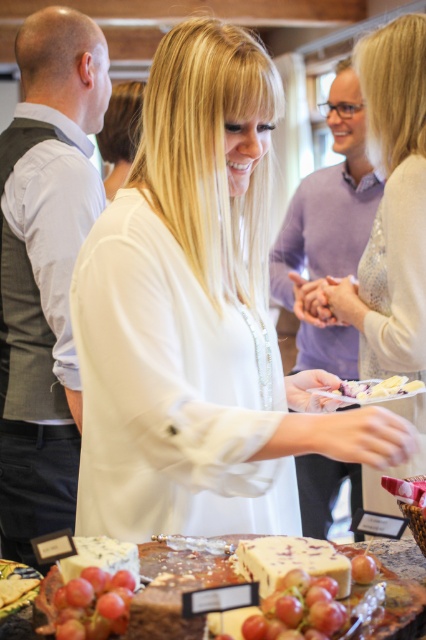
You are at a party and want to grab a smooth red apple at center. You are currently standing behind the smooth wooden table at center. Can you reach the apple without moving around the table?

The smooth wooden table at center is in front of the smooth red apple at center, so you are behind the table and the apple is in front of the table. Therefore, the apple is between you and the table, meaning you can reach it without needing to move around the table.

You are at a party and want to place a smooth red apple at center on the table. Is the smooth wooden table at center the correct place to put it?

The smooth wooden table at center is positioned on the right side of smooth red apple at center, so the apple is already placed on the table. Therefore, the smooth wooden table at center is the correct place to put it.

You are a photographer at the event and need to capture a closeup of the ripe red grapes at lower center without the white matte shirt at center being in the frame. Is this possible given their sizes?

The white matte shirt at center has a larger size compared to ripe red grapes at lower center, so it might block the grapes if positioned between them and the camera. Adjusting the angle or moving closer could help isolate the grapes.